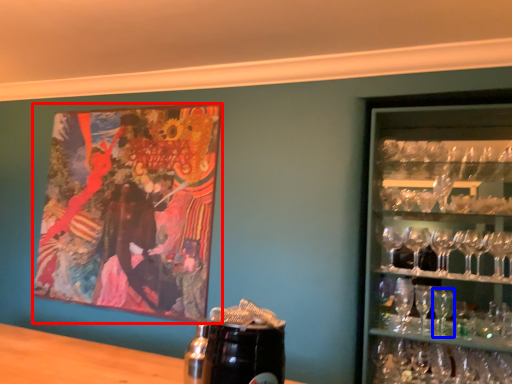
Question: Which of the following is the closest to the observer, picture frame (highlighted by a red box) or martini glass (highlighted by a blue box)?

Choices:
 (A) picture frame
 (B) martini glass

Answer: (B)